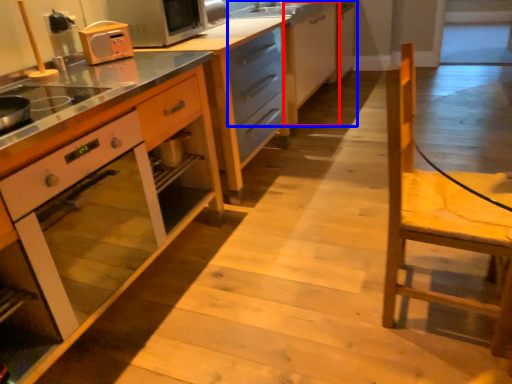
Question: Which point is further to the camera, cabinetry (highlighted by a red box) or cabinetry (highlighted by a blue box)?

Choices:
 (A) cabinetry
 (B) cabinetry

Answer: (A)